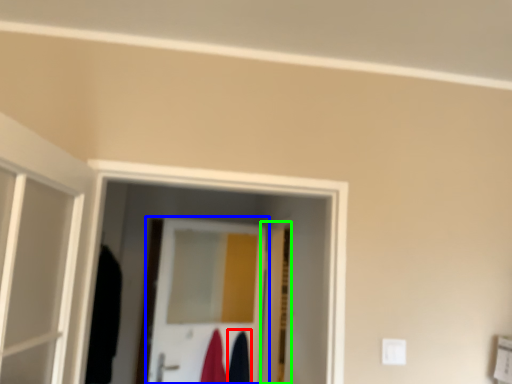
Question: Which is nearer to the robe (highlighted by a red box)? door (highlighted by a blue box) or door (highlighted by a green box).

Choices:
 (A) door
 (B) door

Answer: (A)